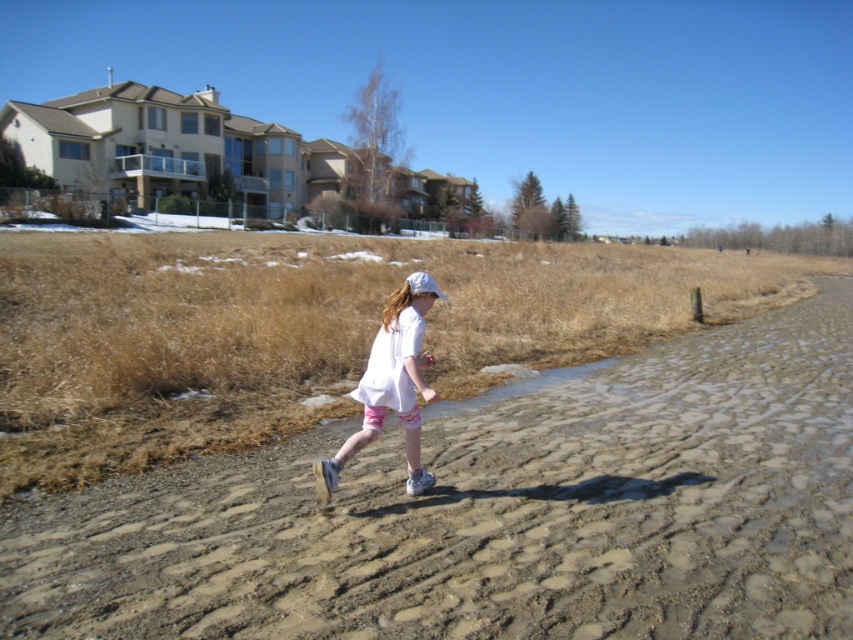
Between brown textured dirt track at center and white cotton shirt at center, which one appears on the right side from the viewer's perspective?

brown textured dirt track at center is more to the right.

This screenshot has height=640, width=853. Describe the element at coordinates (495, 513) in the screenshot. I see `brown textured dirt track at center` at that location.

Identify the location of brown textured dirt track at center. (495, 513).